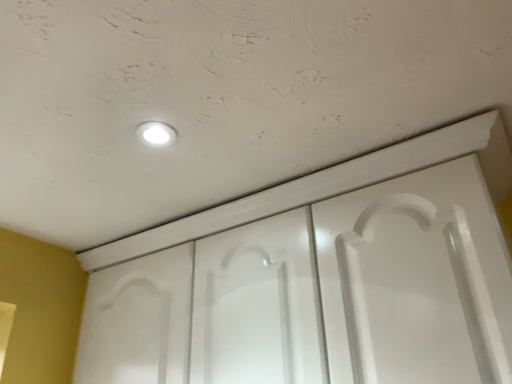
Image resolution: width=512 pixels, height=384 pixels. Describe the element at coordinates (156, 134) in the screenshot. I see `white glossy light fixture at upper center` at that location.

What is the approximate width of white glossy light fixture at upper center?

The width of white glossy light fixture at upper center is 3.73 inches.

You are a GUI agent. You are given a task and a screenshot of the screen. Output one action in this format:
    pyautogui.click(x=<x>, y=<y>)
    Task: Click on the white glossy light fixture at upper center
    The image size is (512, 384).
    Given the screenshot: What is the action you would take?
    pyautogui.click(x=156, y=134)

Describe the element at coordinates (318, 294) in the screenshot. This screenshot has width=512, height=384. I see `white glossy door at center` at that location.

Find the location of a particular element. The width and height of the screenshot is (512, 384). white glossy door at center is located at coordinates (318, 294).

At what (x,y) coordinates should I click in order to perform the action: click on white glossy light fixture at upper center. Please return your answer as a coordinate pair (x, y). The height and width of the screenshot is (384, 512). Looking at the image, I should click on [x=156, y=134].

Which object is positioned more to the right, white glossy light fixture at upper center or white glossy door at center?

From the viewer's perspective, white glossy door at center appears more on the right side.

Is the depth of white glossy light fixture at upper center less than that of white glossy door at center?

No.

Is point (141, 127) positioned before point (325, 302)?

Yes, it is.

From the image's perspective, which one is positioned higher, white glossy light fixture at upper center or white glossy door at center?

white glossy light fixture at upper center appears higher in the image.

From a real-world perspective, which object stands above the other?

white glossy light fixture at upper center is physically above.

Between white glossy light fixture at upper center and white glossy door at center, which one has larger width?

white glossy door at center.

Which of these two, white glossy light fixture at upper center or white glossy door at center, stands shorter?

white glossy light fixture at upper center is shorter.

Between white glossy light fixture at upper center and white glossy door at center, which one has larger size?

white glossy door at center is bigger.

Can white glossy door at center be found inside white glossy light fixture at upper center?

No.

Is white glossy light fixture at upper center far from white glossy door at center?

white glossy light fixture at upper center is near white glossy door at center, not far away.

Is white glossy light fixture at upper center aimed at white glossy door at center?

No, white glossy light fixture at upper center is not turned towards white glossy door at center.

You are a GUI agent. You are given a task and a screenshot of the screen. Output one action in this format:
    pyautogui.click(x=<x>, y=<y>)
    Task: Click on the door that appears in front of the white glossy light fixture at upper center
    The image size is (512, 384).
    Given the screenshot: What is the action you would take?
    pyautogui.click(x=318, y=294)

Would you say white glossy door at center is to the left or to the right of white glossy light fixture at upper center in the picture?

white glossy door at center is to the right of white glossy light fixture at upper center.

Is white glossy door at center closer to camera compared to white glossy light fixture at upper center?

Yes, it is.

Considering the positions of points (176, 299) and (140, 138), is point (176, 299) closer to camera compared to point (140, 138)?

That is False.

From the image's perspective, who appears lower, white glossy door at center or white glossy light fixture at upper center?

white glossy door at center is shown below in the image.

From a real-world perspective, is white glossy door at center over white glossy light fixture at upper center?

No, from a real-world perspective, white glossy door at center is not over white glossy light fixture at upper center

Considering the relative sizes of white glossy door at center and white glossy light fixture at upper center in the image provided, is white glossy door at center thinner than white glossy light fixture at upper center?

No.

Between white glossy door at center and white glossy light fixture at upper center, which one has less height?

With less height is white glossy light fixture at upper center.

From the picture: In terms of size, does white glossy door at center appear bigger or smaller than white glossy light fixture at upper center?

In the image, white glossy door at center appears to be larger than white glossy light fixture at upper center.

Can we say white glossy door at center lies outside white glossy light fixture at upper center?

white glossy door at center is positioned outside white glossy light fixture at upper center.

Is white glossy door at center touching white glossy light fixture at upper center?

No.

Is white glossy light fixture at upper center at the back of white glossy door at center?

No, white glossy door at center is not facing away from white glossy light fixture at upper center.

From the picture: How many degrees apart are the facing directions of white glossy door at center and white glossy light fixture at upper center?

1.22 degrees.

You are a GUI agent. You are given a task and a screenshot of the screen. Output one action in this format:
    pyautogui.click(x=<x>, y=<y>)
    Task: Click on the dot above the white glossy door at center (from the image's perspective)
    This screenshot has height=384, width=512.
    Given the screenshot: What is the action you would take?
    pyautogui.click(x=156, y=134)

The width and height of the screenshot is (512, 384). I want to click on dot that appears above the white glossy door at center (from a real-world perspective), so click(156, 134).

Locate an element on the screen. This screenshot has width=512, height=384. door directly beneath the white glossy light fixture at upper center (from a real-world perspective) is located at coordinates pyautogui.click(x=318, y=294).